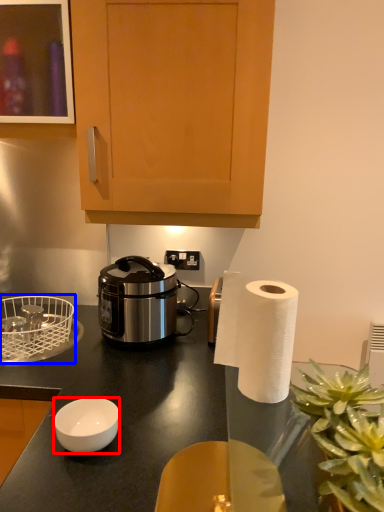
Question: Which point is closer to the camera, bowl (highlighted by a red box) or basket (highlighted by a blue box)?

Choices:
 (A) bowl
 (B) basket

Answer: (A)